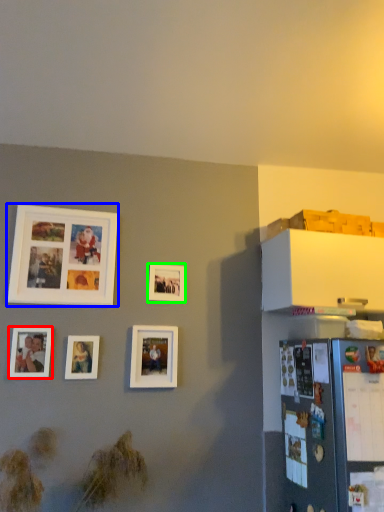
Question: Which object is the closest to the picture frame (highlighted by a red box)? Choose among these: picture frame (highlighted by a blue box) or picture frame (highlighted by a green box).

Choices:
 (A) picture frame
 (B) picture frame

Answer: (A)